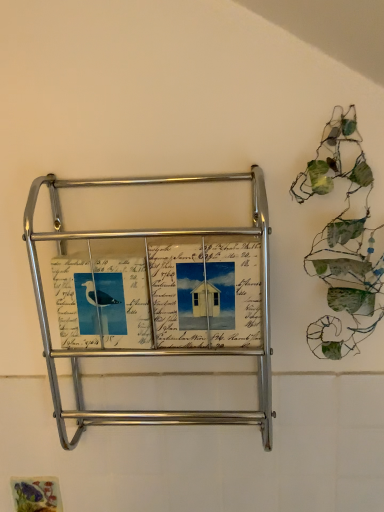
Where is `metallic magazine rack at center`? The width and height of the screenshot is (384, 512). metallic magazine rack at center is located at coordinates (158, 301).

Describe the element at coordinates (158, 301) in the screenshot. I see `metallic magazine rack at center` at that location.

Locate an element on the screen. Image resolution: width=384 pixels, height=512 pixels. metallic magazine rack at center is located at coordinates (158, 301).